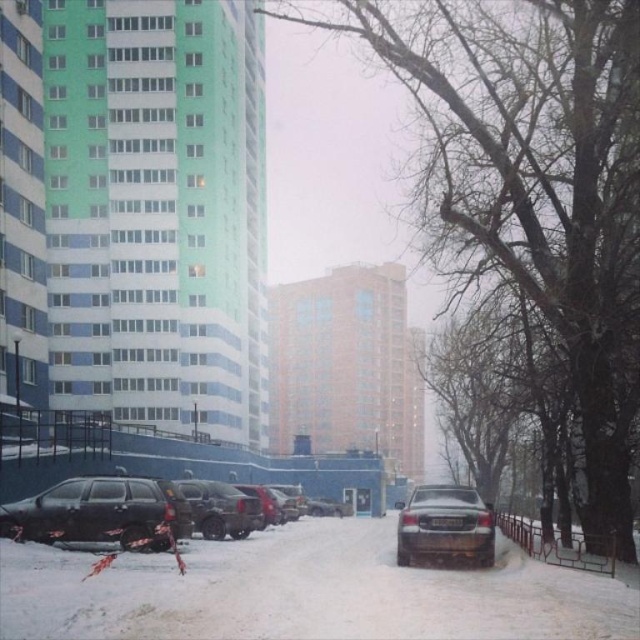
You are a delivery person needing to park between two snow banks on either side of the street. The space between them is exactly 2 meters wide. You have to choose between the dark gray matte car at center and the dark brown matte suv at center. Which vehicle can fit in the space?

The dark brown matte suv at center can fit in the 2 meter space because its width is smaller than the dark gray matte car at center, which is wider and would not fit.

You are a delivery driver who needs to park your dark gray matte truck at center in a spot that can accommodate its height. You notice a dark gray matte car at center parked in front of it. Based on the scene, can you determine if there is enough vertical space between the two vehicles for your truck to pass through?

The dark gray matte car at center is above the dark gray matte truck at center, meaning there is sufficient vertical clearance between them for the truck to pass through without any issues.

You are a delivery driver who needs to park your vehicle in this parking lot. You have a truck that is 2 meters wide. Looking at the dark gray matte suv at lower left and the dark gray matte car at center, which vehicle has a width that would allow your truck to fit between them?

The dark gray matte suv at lower left has a width less than the dark gray matte car at center, so the truck can fit between them if parked next to the suv.